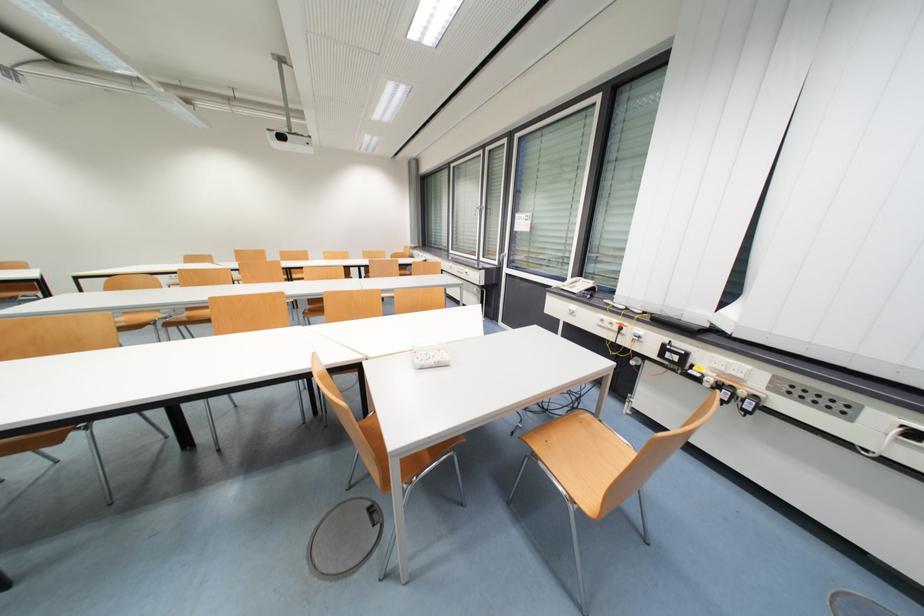
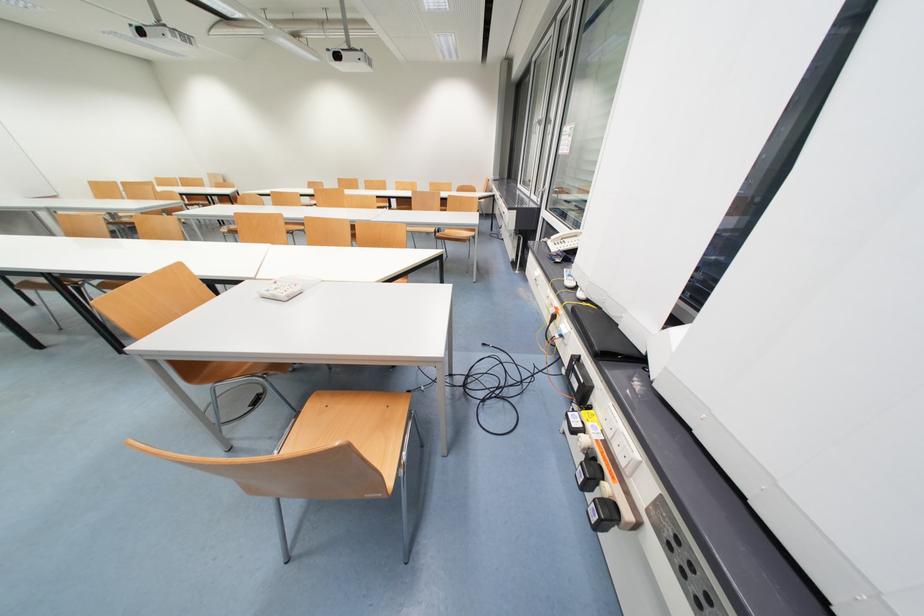
The point at [626,331] is marked in the first image. Where is the corresponding point in the second image?

(560, 318)